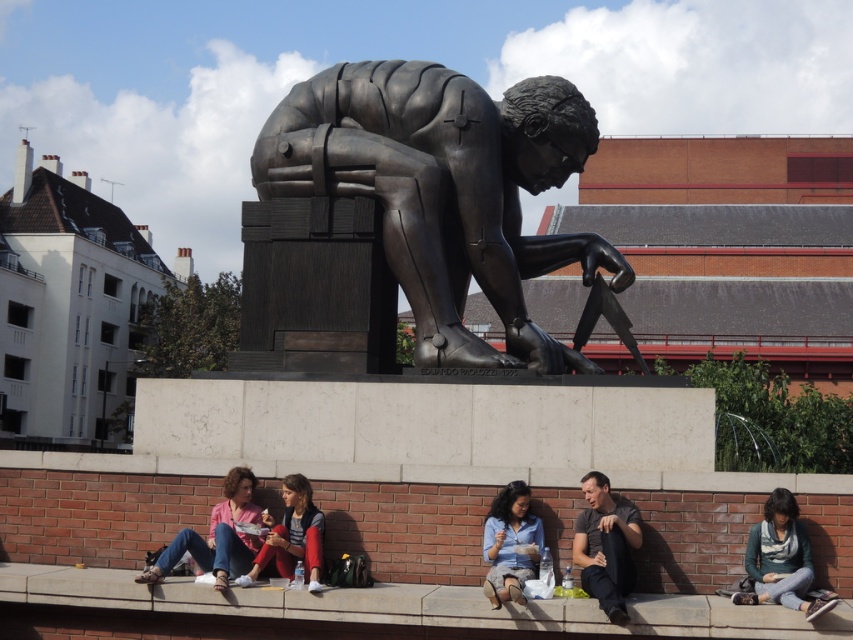
Measure the distance from dark gray fabric shirt at lower center to jeans at lower left.

dark gray fabric shirt at lower center is 7.27 meters away from jeans at lower left.

Can you confirm if dark gray fabric shirt at lower center is positioned to the right of jeans at lower left?

Correct, you'll find dark gray fabric shirt at lower center to the right of jeans at lower left.

Who is more forward, (x=637, y=544) or (x=224, y=582)?

Point (x=224, y=582) is in front.

Locate an element on the screen. Image resolution: width=853 pixels, height=640 pixels. dark gray fabric shirt at lower center is located at coordinates (606, 545).

Between point (76, 588) and point (631, 560), which one is positioned behind?

The point (631, 560) is behind.

Is the position of concrete ledge at lower center more distant than that of dark gray fabric shirt at lower center?

No, it is not.

Who is more distant from viewer, (167, 605) or (624, 536)?

Point (624, 536)

In order to click on concrete ledge at lower center in this screenshot , I will do `click(366, 611)`.

Can you confirm if concrete ledge at lower center is wider than matte black jacket at center?

Correct, the width of concrete ledge at lower center exceeds that of matte black jacket at center.

The width and height of the screenshot is (853, 640). In order to click on concrete ledge at lower center in this screenshot , I will do `click(366, 611)`.